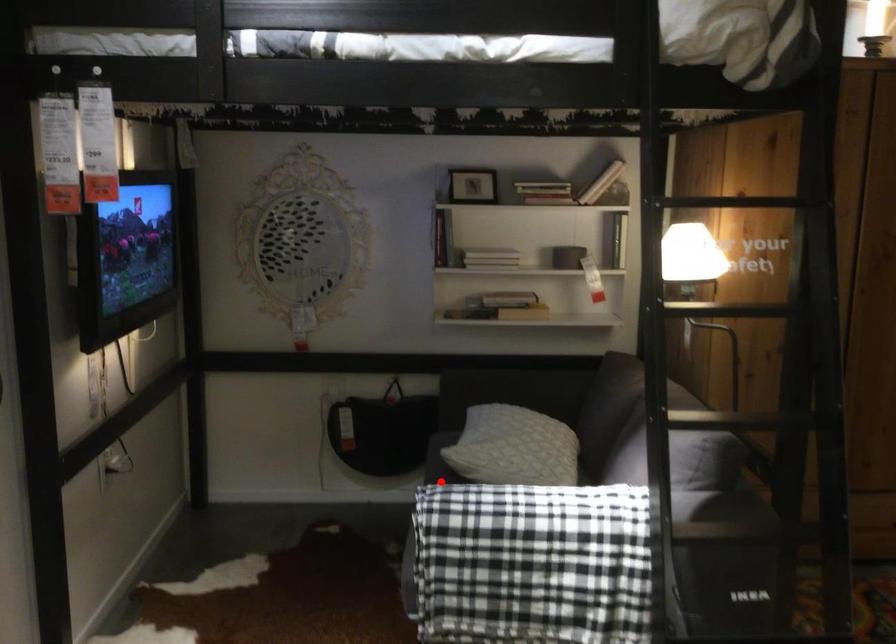
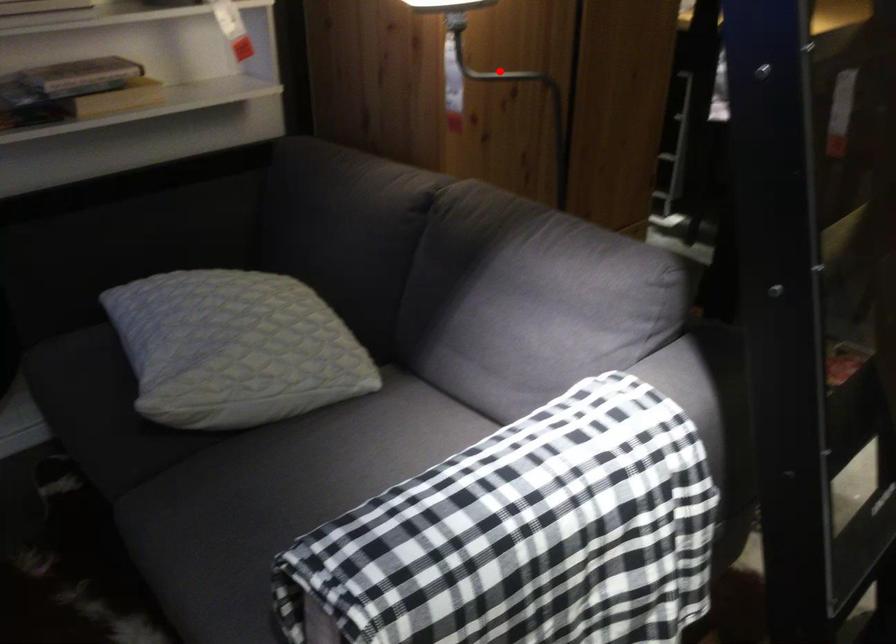
Based on the photo, I am providing you with two images of the same scene from different viewpoints. A red point is marked on the first image and another point is marked on the second image. Is the marked point in image1 the same physical position as the marked point in image2?

No